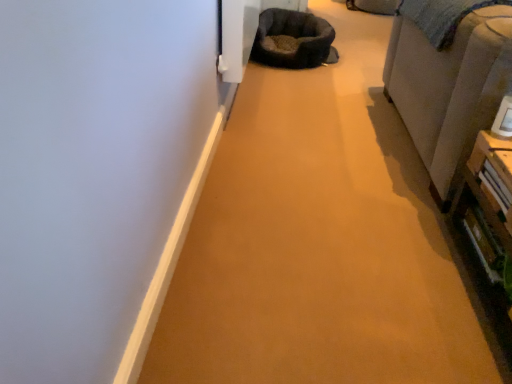
The image size is (512, 384). I want to click on dark brown plush bean bag chair at upper center, so click(x=292, y=39).

Measure the distance between point (303, 20) and camera.

3.20 meters.

Describe the element at coordinates (292, 39) in the screenshot. I see `dark brown plush bean bag chair at upper center` at that location.

Measure the distance between beige fabric couch at right and camera.

beige fabric couch at right is 1.27 meters away from camera.

Identify the location of beige fabric couch at right. The width and height of the screenshot is (512, 384). (449, 88).

Describe the element at coordinates (449, 88) in the screenshot. I see `beige fabric couch at right` at that location.

The width and height of the screenshot is (512, 384). What are the coordinates of `dark brown plush bean bag chair at upper center` in the screenshot? It's located at (292, 39).

Considering the positions of objects beige fabric couch at right and dark brown plush bean bag chair at upper center in the image provided, who is more to the right, beige fabric couch at right or dark brown plush bean bag chair at upper center?

Positioned to the right is beige fabric couch at right.

Considering the relative positions of beige fabric couch at right and dark brown plush bean bag chair at upper center in the image provided, is beige fabric couch at right behind dark brown plush bean bag chair at upper center?

No, beige fabric couch at right is closer to the camera.

Is point (495, 77) less distant than point (265, 47)?

That is True.

From the image's perspective, which one is positioned lower, beige fabric couch at right or dark brown plush bean bag chair at upper center?

beige fabric couch at right appears lower in the image.

From a real-world perspective, which is physically above, beige fabric couch at right or dark brown plush bean bag chair at upper center?

In real-world perspective, beige fabric couch at right is above.

Considering the relative sizes of beige fabric couch at right and dark brown plush bean bag chair at upper center in the image provided, is beige fabric couch at right thinner than dark brown plush bean bag chair at upper center?

In fact, beige fabric couch at right might be wider than dark brown plush bean bag chair at upper center.

Between beige fabric couch at right and dark brown plush bean bag chair at upper center, which one has more height?

Standing taller between the two is beige fabric couch at right.

Does beige fabric couch at right have a smaller size compared to dark brown plush bean bag chair at upper center?

No.

Would you say beige fabric couch at right is inside or outside dark brown plush bean bag chair at upper center?

beige fabric couch at right is spatially situated outside dark brown plush bean bag chair at upper center.

Does beige fabric couch at right touch dark brown plush bean bag chair at upper center?

No, beige fabric couch at right is not touching dark brown plush bean bag chair at upper center.

Is beige fabric couch at right turned away from dark brown plush bean bag chair at upper center?

No.

What's the angular difference between beige fabric couch at right and dark brown plush bean bag chair at upper center's facing directions?

The facing directions of beige fabric couch at right and dark brown plush bean bag chair at upper center are 1.39 degrees apart.

Consider the image. Measure the distance between beige fabric couch at right and dark brown plush bean bag chair at upper center.

A distance of 1.20 meters exists between beige fabric couch at right and dark brown plush bean bag chair at upper center.

The width and height of the screenshot is (512, 384). Identify the location of bean bag chair lying above the beige fabric couch at right (from the image's perspective). (292, 39).

In the image, is dark brown plush bean bag chair at upper center on the left side or the right side of beige fabric couch at right?

In the image, dark brown plush bean bag chair at upper center appears on the left side of beige fabric couch at right.

Who is more distant, dark brown plush bean bag chair at upper center or beige fabric couch at right?

dark brown plush bean bag chair at upper center is further from the camera.

Does point (270, 56) come behind point (466, 96)?

Yes, it is behind point (466, 96).

From the image's perspective, is dark brown plush bean bag chair at upper center on beige fabric couch at right?

Indeed, from the image's perspective, dark brown plush bean bag chair at upper center is shown above beige fabric couch at right.

From a real-world perspective, is dark brown plush bean bag chair at upper center on top of beige fabric couch at right?

No, from a real-world perspective, dark brown plush bean bag chair at upper center is not on top of beige fabric couch at right.

From the picture: Looking at their sizes, would you say dark brown plush bean bag chair at upper center is wider or thinner than beige fabric couch at right?

In the image, dark brown plush bean bag chair at upper center appears to be more narrow than beige fabric couch at right.

Which of these two, dark brown plush bean bag chair at upper center or beige fabric couch at right, stands shorter?

dark brown plush bean bag chair at upper center.

In terms of size, does dark brown plush bean bag chair at upper center appear bigger or smaller than beige fabric couch at right?

In the image, dark brown plush bean bag chair at upper center appears to be smaller than beige fabric couch at right.

Is dark brown plush bean bag chair at upper center located outside beige fabric couch at right?

Yes, dark brown plush bean bag chair at upper center is not within beige fabric couch at right.

Is dark brown plush bean bag chair at upper center positioned far away from beige fabric couch at right?

Yes, dark brown plush bean bag chair at upper center and beige fabric couch at right are quite far apart.

Is dark brown plush bean bag chair at upper center looking in the opposite direction of beige fabric couch at right?

No, beige fabric couch at right is not at the back of dark brown plush bean bag chair at upper center.

How many degrees apart are the facing directions of dark brown plush bean bag chair at upper center and beige fabric couch at right?

There is a 1.39-degree angle between the facing directions of dark brown plush bean bag chair at upper center and beige fabric couch at right.

This screenshot has width=512, height=384. In the image, there is a beige fabric couch at right. Identify the location of bean bag chair below it (from a real-world perspective). (292, 39).

Image resolution: width=512 pixels, height=384 pixels. I want to click on furniture on the right of dark brown plush bean bag chair at upper center, so click(449, 88).

I want to click on furniture below the dark brown plush bean bag chair at upper center (from the image's perspective), so click(449, 88).